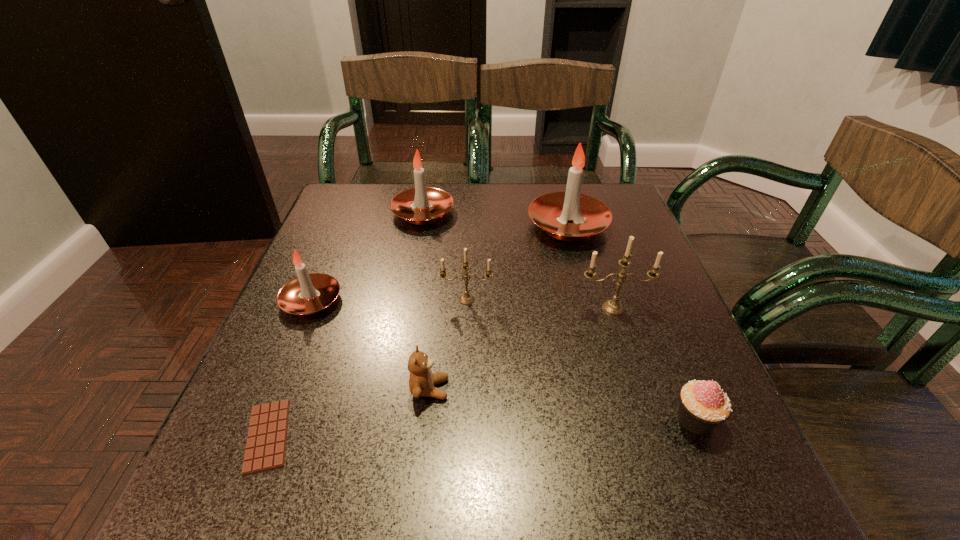
This screenshot has width=960, height=540. I want to click on candy bar, so click(x=266, y=443).

Identify the location of vacant space located 0.090m on the back of the tallest candle. This screenshot has height=540, width=960. (558, 187).

Locate an element on the screen. This screenshot has width=960, height=540. free space located on the left of the second white candle from left to right is located at coordinates (335, 213).

Identify the location of vacant space located on the back of the right metallic candle. (589, 234).

Locate an element on the screen. The width and height of the screenshot is (960, 540). vacant area located on the back of the nearest white candle is located at coordinates (348, 214).

Locate an element on the screen. The width and height of the screenshot is (960, 540). free spot located on the front of the smaller metallic candle is located at coordinates (466, 323).

Where is `vacant space situated on the front-facing side of the teddy bear`? vacant space situated on the front-facing side of the teddy bear is located at coordinates (593, 389).

Identify the location of blank area located 0.130m on the back of the pink cupcake. (662, 340).

The width and height of the screenshot is (960, 540). In order to click on free location located 0.290m on the right of the brown candy bar in this screenshot , I will do `click(480, 436)`.

This screenshot has width=960, height=540. In order to click on object present at the near edge in this screenshot , I will do `click(266, 443)`.